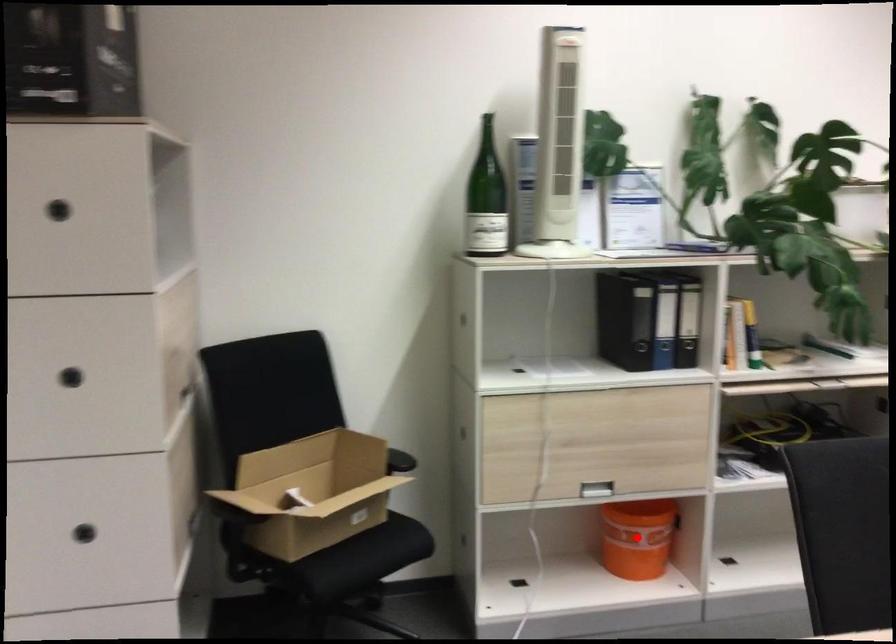
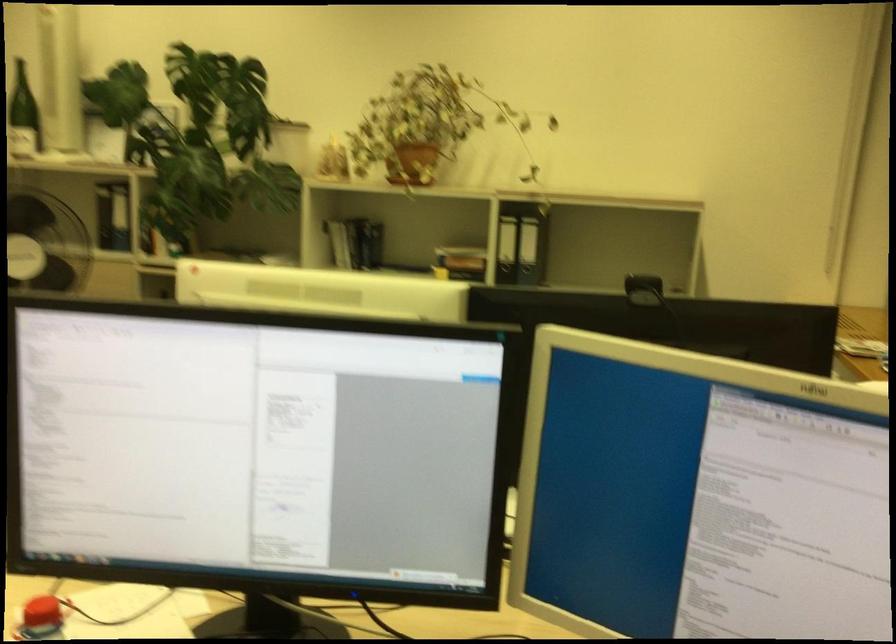
Question: I am providing you with two images of the same scene from different viewpoints. A red point is marked on the first image. Is the red point's position out of view in image 2?

Choices:
 (A) Yes
 (B) No

Answer: (A)